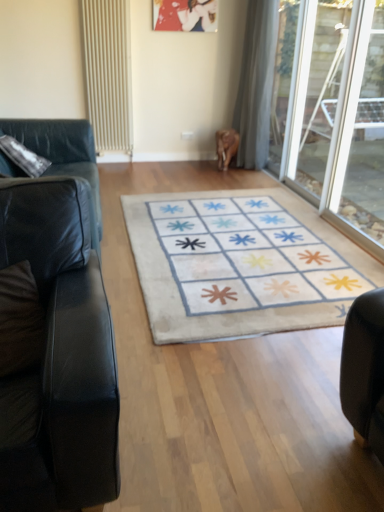
Question: Considering the relative sizes of brown suede pillow at left and transparent glass door at right, the 1th glass door from the back, in the image provided, is brown suede pillow at left taller than transparent glass door at right, the 1th glass door from the back,?

Choices:
 (A) no
 (B) yes

Answer: (A)

Question: Can you confirm if brown suede pillow at left is bigger than transparent glass door at right, which is the 2th glass door in front-to-back order?

Choices:
 (A) no
 (B) yes

Answer: (A)

Question: Is transparent glass door at right, which is the 2th glass door in front-to-back order, located within brown suede pillow at left?

Choices:
 (A) no
 (B) yes

Answer: (A)

Question: Is the depth of brown suede pillow at left greater than that of transparent glass door at right, which is the 2th glass door in front-to-back order?

Choices:
 (A) yes
 (B) no

Answer: (B)

Question: Can you confirm if brown suede pillow at left is shorter than transparent glass door at right, which is the 2th glass door in front-to-back order?

Choices:
 (A) no
 (B) yes

Answer: (B)

Question: Considering the positions of transparent glass door at right, the 1th glass door from the back, and transparent glass door at right, which is the 1th glass door in front-to-back order, in the image, is transparent glass door at right, the 1th glass door from the back, wider or thinner than transparent glass door at right, which is the 1th glass door in front-to-back order,?

Choices:
 (A) wide
 (B) thin

Answer: (B)

Question: From a real-world perspective, relative to transparent glass door at right, the 2th glass door positioned from the back, is transparent glass door at right, the 1th glass door from the back, vertically above or below?

Choices:
 (A) below
 (B) above

Answer: (B)

Question: Which is correct: transparent glass door at right, the 1th glass door from the back, is inside transparent glass door at right, the 2th glass door positioned from the back, or outside of it?

Choices:
 (A) inside
 (B) outside

Answer: (B)

Question: Is transparent glass door at right, the 1th glass door from the back, in front of or behind transparent glass door at right, which is the 1th glass door in front-to-back order, in the image?

Choices:
 (A) behind
 (B) front

Answer: (A)

Question: Do you think metallic silver picture frame at upper center is within brown suede pillow at left, or outside of it?

Choices:
 (A) outside
 (B) inside

Answer: (A)

Question: In terms of width, does metallic silver picture frame at upper center look wider or thinner when compared to brown suede pillow at left?

Choices:
 (A) wide
 (B) thin

Answer: (B)

Question: From a real-world perspective, is metallic silver picture frame at upper center above or below brown suede pillow at left?

Choices:
 (A) above
 (B) below

Answer: (A)

Question: From the image's perspective, is metallic silver picture frame at upper center above or below brown suede pillow at left?

Choices:
 (A) above
 (B) below

Answer: (A)

Question: Looking at the image, does black leather couch at left, which appears as the 1th studio couch when viewed from the back, seem bigger or smaller compared to black leather couch at left, the 2th studio couch positioned from the back?

Choices:
 (A) big
 (B) small

Answer: (A)

Question: In terms of height, does black leather couch at left, placed as the second studio couch when sorted from front to back, look taller or shorter compared to black leather couch at left, positioned as the first studio couch in front-to-back order?

Choices:
 (A) tall
 (B) short

Answer: (B)